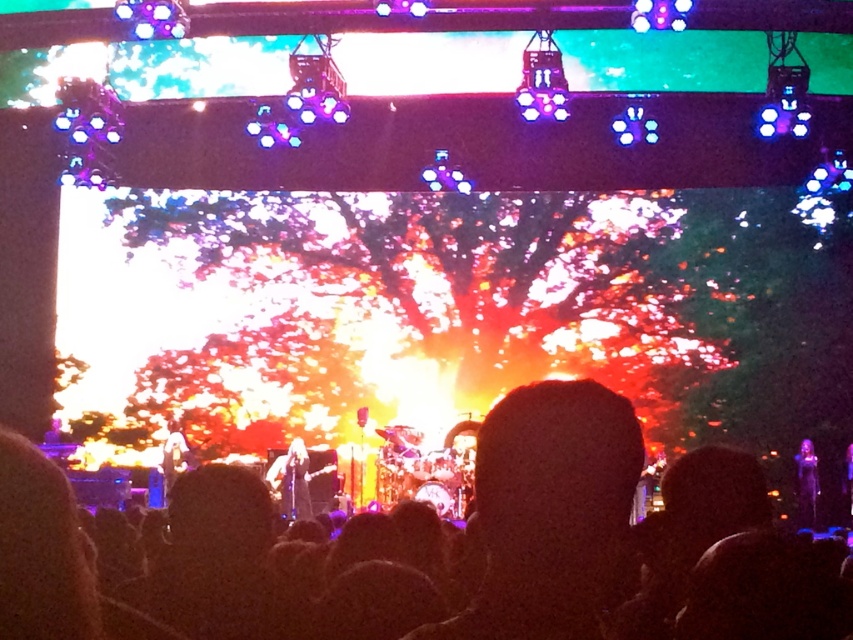
Is point (679, 570) positioned in front of point (177, 420)?

Yes, it is in front of point (177, 420).

Between point (579, 413) and point (180, 440), which one is positioned behind?

The point (180, 440) is more distant.

Does point (654, 579) lie behind point (178, 433)?

No, (654, 579) is closer to viewer.

This screenshot has height=640, width=853. Identify the location of silhouette crowd at center. (473, 541).

Consider the image. Can you confirm if shiny black dress at lower right is positioned to the left of shiny silver guitar at center?

In fact, shiny black dress at lower right is to the right of shiny silver guitar at center.

Can you confirm if shiny black dress at lower right is positioned to the right of shiny silver guitar at center?

Correct, you'll find shiny black dress at lower right to the right of shiny silver guitar at center.

Where is `shiny black dress at lower right`? Image resolution: width=853 pixels, height=640 pixels. shiny black dress at lower right is located at coordinates (805, 483).

Which is behind, point (289, 508) or point (801, 525)?

Point (801, 525)

Which of these two, shiny black guitar at center or shiny black dress at lower right, stands shorter?

shiny black guitar at center is shorter.

Describe the element at coordinates (294, 483) in the screenshot. I see `shiny black guitar at center` at that location.

Identify the location of shiny black guitar at center. The height and width of the screenshot is (640, 853). tap(294, 483).